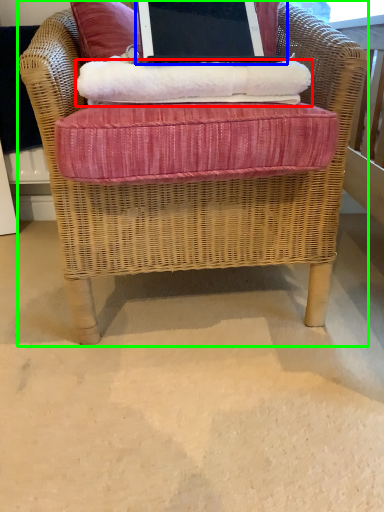
Question: Which is farther away from material (highlighted by a red box)? laptop (highlighted by a blue box) or chair (highlighted by a green box)?

Choices:
 (A) laptop
 (B) chair

Answer: (A)